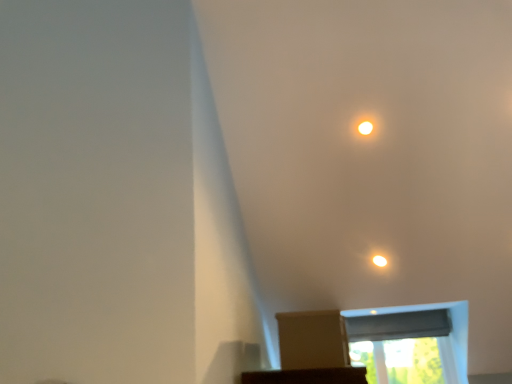
What do you see at coordinates (399, 325) in the screenshot? I see `black fabric window screen at lower center, the second window screen when ordered from bottom to top` at bounding box center [399, 325].

Where is `transparent plastic window screen at upper center, arranged as the 2th window screen when viewed from the top`? This screenshot has height=384, width=512. transparent plastic window screen at upper center, arranged as the 2th window screen when viewed from the top is located at coordinates (408, 360).

Measure the distance between point (409,377) and camera.

They are 12.92 feet apart.

Describe the element at coordinates (312, 340) in the screenshot. I see `brown cardboard box at center` at that location.

Find the location of `matte white light at upper center`. matte white light at upper center is located at coordinates (366, 126).

The image size is (512, 384). Identify the location of black fabric window screen at lower center, the second window screen when ordered from bottom to top. (399, 325).

Is matte white light at upper center directly adjacent to matte white light at upper center?

No, matte white light at upper center is not touching matte white light at upper center.

Is matte white light at upper center closer to camera compared to matte white light at upper center?

Yes.

Is matte white light at upper center at the left side of matte white light at upper center?

Indeed, matte white light at upper center is positioned on the left side of matte white light at upper center.

Which of these two, matte white light at upper center or matte white light at upper center, is smaller?

With smaller size is matte white light at upper center.

Would you say transparent plastic window screen at upper center, arranged as the 2th window screen when viewed from the top, is inside or outside black fabric window screen at lower center, the 1th window screen in the top-to-bottom sequence?

transparent plastic window screen at upper center, arranged as the 2th window screen when viewed from the top, lies outside black fabric window screen at lower center, the 1th window screen in the top-to-bottom sequence.

Is transparent plastic window screen at upper center, marked as the 1th window screen in a bottom-to-top arrangement, facing towards black fabric window screen at lower center, the 1th window screen in the top-to-bottom sequence?

No, transparent plastic window screen at upper center, marked as the 1th window screen in a bottom-to-top arrangement, is not facing towards black fabric window screen at lower center, the 1th window screen in the top-to-bottom sequence.

What's the angular difference between transparent plastic window screen at upper center, marked as the 1th window screen in a bottom-to-top arrangement, and black fabric window screen at lower center, the second window screen when ordered from bottom to top,'s facing directions?

The angular difference between transparent plastic window screen at upper center, marked as the 1th window screen in a bottom-to-top arrangement, and black fabric window screen at lower center, the second window screen when ordered from bottom to top, is 0.000685 degrees.

This screenshot has height=384, width=512. I want to click on window screen that appears on the left of transparent plastic window screen at upper center, arranged as the 2th window screen when viewed from the top, so click(x=399, y=325).

Is matte white light at upper center beside brown cardboard box at center?

No, matte white light at upper center is not in contact with brown cardboard box at center.

Which is more to the left, matte white light at upper center or brown cardboard box at center?

brown cardboard box at center.

The width and height of the screenshot is (512, 384). Identify the location of light above the brown cardboard box at center (from a real-world perspective). (379, 260).

Does matte white light at upper center have a greater height compared to brown cardboard box at center?

No, matte white light at upper center is not taller than brown cardboard box at center.

Identify the location of light above the transparent plastic window screen at upper center, arranged as the 2th window screen when viewed from the top (from the image's perspective). (379, 260).

Based on the photo, considering the sizes of matte white light at upper center and transparent plastic window screen at upper center, arranged as the 2th window screen when viewed from the top, in the image, is matte white light at upper center taller or shorter than transparent plastic window screen at upper center, arranged as the 2th window screen when viewed from the top,?

Clearly, matte white light at upper center is shorter compared to transparent plastic window screen at upper center, arranged as the 2th window screen when viewed from the top.

Does matte white light at upper center appear on the right side of transparent plastic window screen at upper center, marked as the 1th window screen in a bottom-to-top arrangement?

In fact, matte white light at upper center is to the left of transparent plastic window screen at upper center, marked as the 1th window screen in a bottom-to-top arrangement.

Considering the relative sizes of matte white light at upper center and transparent plastic window screen at upper center, marked as the 1th window screen in a bottom-to-top arrangement, in the image provided, is matte white light at upper center wider than transparent plastic window screen at upper center, marked as the 1th window screen in a bottom-to-top arrangement,?

In fact, matte white light at upper center might be narrower than transparent plastic window screen at upper center, marked as the 1th window screen in a bottom-to-top arrangement.

Which point is more distant from viewer, (436, 341) or (313, 360)?

The point (436, 341) is farther.

Consider the image. From the image's perspective, is transparent plastic window screen at upper center, arranged as the 2th window screen when viewed from the top, above or below brown cardboard box at center?

From the image's perspective, transparent plastic window screen at upper center, arranged as the 2th window screen when viewed from the top, appears below brown cardboard box at center.

Between transparent plastic window screen at upper center, marked as the 1th window screen in a bottom-to-top arrangement, and brown cardboard box at center, which one has smaller size?

brown cardboard box at center is smaller.

Choose the correct answer: Is transparent plastic window screen at upper center, arranged as the 2th window screen when viewed from the top, inside brown cardboard box at center or outside it?

transparent plastic window screen at upper center, arranged as the 2th window screen when viewed from the top, exists outside the volume of brown cardboard box at center.

Does brown cardboard box at center have a larger size compared to transparent plastic window screen at upper center, marked as the 1th window screen in a bottom-to-top arrangement?

No, brown cardboard box at center is not bigger than transparent plastic window screen at upper center, marked as the 1th window screen in a bottom-to-top arrangement.

Is brown cardboard box at center to the left of transparent plastic window screen at upper center, arranged as the 2th window screen when viewed from the top, from the viewer's perspective?

Yes, brown cardboard box at center is to the left of transparent plastic window screen at upper center, arranged as the 2th window screen when viewed from the top.

From a real-world perspective, which is physically above, brown cardboard box at center or transparent plastic window screen at upper center, arranged as the 2th window screen when viewed from the top?

In real-world perspective, brown cardboard box at center is above.

From the image's perspective, which is below, transparent plastic window screen at upper center, arranged as the 2th window screen when viewed from the top, or matte white light at upper center?

transparent plastic window screen at upper center, arranged as the 2th window screen when viewed from the top, is shown below in the image.

This screenshot has height=384, width=512. Find the location of `the 2nd window screen located beneath the matte white light at upper center (from a real-world perspective)`. the 2nd window screen located beneath the matte white light at upper center (from a real-world perspective) is located at coordinates (408, 360).

Based on the photo, from a real-world perspective, is transparent plastic window screen at upper center, arranged as the 2th window screen when viewed from the top, above or below matte white light at upper center?

In terms of real-world spatial position, transparent plastic window screen at upper center, arranged as the 2th window screen when viewed from the top, is below matte white light at upper center.

Between transparent plastic window screen at upper center, marked as the 1th window screen in a bottom-to-top arrangement, and matte white light at upper center, which one is positioned behind?

transparent plastic window screen at upper center, marked as the 1th window screen in a bottom-to-top arrangement, is further from the camera.

Locate an element on the screen. Image resolution: width=512 pixels, height=384 pixels. dot located on the left of matte white light at upper center is located at coordinates (366, 126).

Locate an element on the screen. This screenshot has width=512, height=384. window screen behind the transparent plastic window screen at upper center, arranged as the 2th window screen when viewed from the top is located at coordinates (399, 325).

Estimate the real-world distances between objects in this image. Which object is closer to transparent plastic window screen at upper center, marked as the 1th window screen in a bottom-to-top arrangement, brown cardboard box at center or black fabric window screen at lower center, the 1th window screen in the top-to-bottom sequence?

Among the two, black fabric window screen at lower center, the 1th window screen in the top-to-bottom sequence, is located nearer to transparent plastic window screen at upper center, marked as the 1th window screen in a bottom-to-top arrangement.

Which object lies nearer to the anchor point transparent plastic window screen at upper center, marked as the 1th window screen in a bottom-to-top arrangement, brown cardboard box at center or matte white light at upper center?

brown cardboard box at center lies closer to transparent plastic window screen at upper center, marked as the 1th window screen in a bottom-to-top arrangement, than the other object.

Based on their spatial positions, is brown cardboard box at center or matte white light at upper center closer to matte white light at upper center?

Based on the image, matte white light at upper center appears to be nearer to matte white light at upper center.

Based on their spatial positions, is matte white light at upper center or matte white light at upper center further from black fabric window screen at lower center, the 1th window screen in the top-to-bottom sequence?

Among the two, matte white light at upper center is located further to black fabric window screen at lower center, the 1th window screen in the top-to-bottom sequence.

Considering their positions, is matte white light at upper center positioned further to brown cardboard box at center than transparent plastic window screen at upper center, marked as the 1th window screen in a bottom-to-top arrangement?

The object further to brown cardboard box at center is transparent plastic window screen at upper center, marked as the 1th window screen in a bottom-to-top arrangement.

Based on their spatial positions, is matte white light at upper center or transparent plastic window screen at upper center, marked as the 1th window screen in a bottom-to-top arrangement, closer to brown cardboard box at center?

matte white light at upper center is positioned closer to the anchor brown cardboard box at center.

In the scene shown: Based on their spatial positions, is brown cardboard box at center or matte white light at upper center further from transparent plastic window screen at upper center, arranged as the 2th window screen when viewed from the top?

brown cardboard box at center lies further to transparent plastic window screen at upper center, arranged as the 2th window screen when viewed from the top, than the other object.

When comparing their distances from matte white light at upper center, does black fabric window screen at lower center, the 1th window screen in the top-to-bottom sequence, or brown cardboard box at center seem further?

black fabric window screen at lower center, the 1th window screen in the top-to-bottom sequence, is positioned further to the anchor matte white light at upper center.

Where is `cardboard box that lies between matte white light at upper center and black fabric window screen at lower center, the second window screen when ordered from bottom to top, from top to bottom`? This screenshot has height=384, width=512. cardboard box that lies between matte white light at upper center and black fabric window screen at lower center, the second window screen when ordered from bottom to top, from top to bottom is located at coordinates (312, 340).

The image size is (512, 384). Identify the location of window screen that lies between matte white light at upper center and transparent plastic window screen at upper center, arranged as the 2th window screen when viewed from the top, from top to bottom. (399, 325).

The height and width of the screenshot is (384, 512). I want to click on light between matte white light at upper center and transparent plastic window screen at upper center, arranged as the 2th window screen when viewed from the top, vertically, so click(x=379, y=260).

Find the location of a particular element. light between matte white light at upper center and black fabric window screen at lower center, the 1th window screen in the top-to-bottom sequence, vertically is located at coordinates (379, 260).